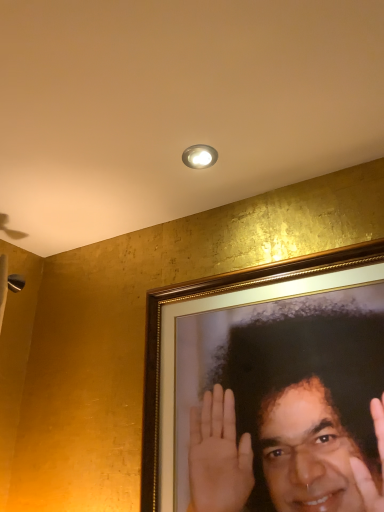
The image size is (384, 512). Describe the element at coordinates (199, 156) in the screenshot. I see `matte silver light fixture at upper center` at that location.

The width and height of the screenshot is (384, 512). I want to click on matte silver light fixture at upper center, so click(199, 156).

Describe the element at coordinates (284, 425) in the screenshot. The height and width of the screenshot is (512, 384). I see `smooth gold frame at upper right` at that location.

I want to click on smooth gold frame at upper right, so click(x=284, y=425).

Where is `matte silver light fixture at upper center`? Image resolution: width=384 pixels, height=512 pixels. matte silver light fixture at upper center is located at coordinates (199, 156).

Is smooth gold frame at upper right to the left or to the right of matte silver light fixture at upper center in the image?

In the image, smooth gold frame at upper right appears on the right side of matte silver light fixture at upper center.

Which object is closer to the camera taking this photo, smooth gold frame at upper right or matte silver light fixture at upper center?

smooth gold frame at upper right.

Is point (294, 474) more distant than point (194, 148)?

No, it is not.

From the image's perspective, between smooth gold frame at upper right and matte silver light fixture at upper center, who is located below?

smooth gold frame at upper right is shown below in the image.

From the picture: From a real-world perspective, between smooth gold frame at upper right and matte silver light fixture at upper center, who is vertically lower?

smooth gold frame at upper right is physically lower.

Consider the image. Looking at their sizes, would you say smooth gold frame at upper right is wider or thinner than matte silver light fixture at upper center?

Clearly, smooth gold frame at upper right has less width compared to matte silver light fixture at upper center.

Who is shorter, smooth gold frame at upper right or matte silver light fixture at upper center?

matte silver light fixture at upper center.

Considering the relative sizes of smooth gold frame at upper right and matte silver light fixture at upper center in the image provided, is smooth gold frame at upper right bigger than matte silver light fixture at upper center?

Correct, smooth gold frame at upper right is larger in size than matte silver light fixture at upper center.

Is matte silver light fixture at upper center surrounded by smooth gold frame at upper right?

Actually, matte silver light fixture at upper center is outside smooth gold frame at upper right.

Is smooth gold frame at upper right far from matte silver light fixture at upper center?

They are positioned close to each other.

Is smooth gold frame at upper right turned away from matte silver light fixture at upper center?

smooth gold frame at upper right is not turned away from matte silver light fixture at upper center.

What's the angular difference between smooth gold frame at upper right and matte silver light fixture at upper center's facing directions?

The angular difference between smooth gold frame at upper right and matte silver light fixture at upper center is 6.04 degrees.

I want to click on light fixture above the smooth gold frame at upper right (from the image's perspective), so click(199, 156).

Considering the positions of objects matte silver light fixture at upper center and smooth gold frame at upper right in the image provided, who is more to the left, matte silver light fixture at upper center or smooth gold frame at upper right?

matte silver light fixture at upper center.

Relative to smooth gold frame at upper right, is matte silver light fixture at upper center in front or behind?

Clearly, matte silver light fixture at upper center is behind smooth gold frame at upper right.

Is point (199, 166) more distant than point (319, 444)?

Yes, it is behind point (319, 444).

From the image's perspective, which is above, matte silver light fixture at upper center or smooth gold frame at upper right?

matte silver light fixture at upper center, from the image's perspective.

From a real-world perspective, between matte silver light fixture at upper center and smooth gold frame at upper right, who is vertically higher?

matte silver light fixture at upper center.

Looking at this image, does matte silver light fixture at upper center have a lesser width compared to smooth gold frame at upper right?

In fact, matte silver light fixture at upper center might be wider than smooth gold frame at upper right.

Considering the relative sizes of matte silver light fixture at upper center and smooth gold frame at upper right in the image provided, is matte silver light fixture at upper center shorter than smooth gold frame at upper right?

Yes.

Is matte silver light fixture at upper center bigger or smaller than smooth gold frame at upper right?

Considering their sizes, matte silver light fixture at upper center takes up less space than smooth gold frame at upper right.

Is matte silver light fixture at upper center inside or outside of smooth gold frame at upper right?

matte silver light fixture at upper center cannot be found inside smooth gold frame at upper right.

Is matte silver light fixture at upper center far from smooth gold frame at upper right?

matte silver light fixture at upper center is actually quite close to smooth gold frame at upper right.

Is matte silver light fixture at upper center looking in the opposite direction of smooth gold frame at upper right?

No, matte silver light fixture at upper center's orientation is not away from smooth gold frame at upper right.

You are a GUI agent. You are given a task and a screenshot of the screen. Output one action in this format:
    pyautogui.click(x=<x>, y=<y>)
    Task: Click on the light fixture that is behind the smooth gold frame at upper right
    Image resolution: width=384 pixels, height=512 pixels.
    Given the screenshot: What is the action you would take?
    199,156

I want to click on man below the matte silver light fixture at upper center (from the image's perspective), so click(284, 425).

Locate an element on the screen. The image size is (384, 512). man lying in front of the matte silver light fixture at upper center is located at coordinates (284, 425).